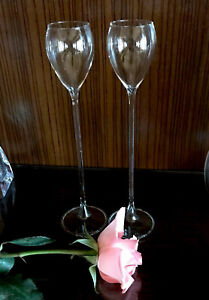
Image resolution: width=209 pixels, height=300 pixels. What are the coordinates of `left tall glass` in the screenshot? It's located at (62, 68).